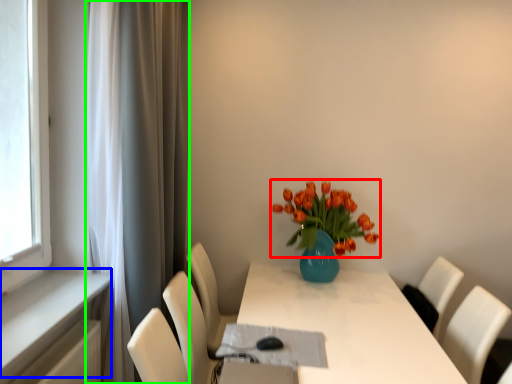
Question: Based on their relative distances, which object is farther from flower (highlighted by a red box)? Choose from window sill (highlighted by a blue box) and curtain (highlighted by a green box).

Choices:
 (A) window sill
 (B) curtain

Answer: (A)